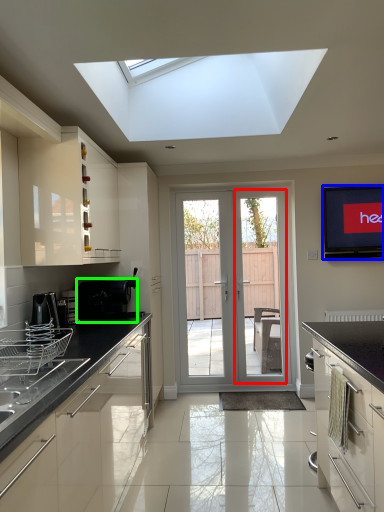
Question: Estimate the real-world distances between objects in this image. Which object is farther from screen door (highlighted by a red box), electronic (highlighted by a blue box) or appliance (highlighted by a green box)?

Choices:
 (A) electronic
 (B) appliance

Answer: (B)